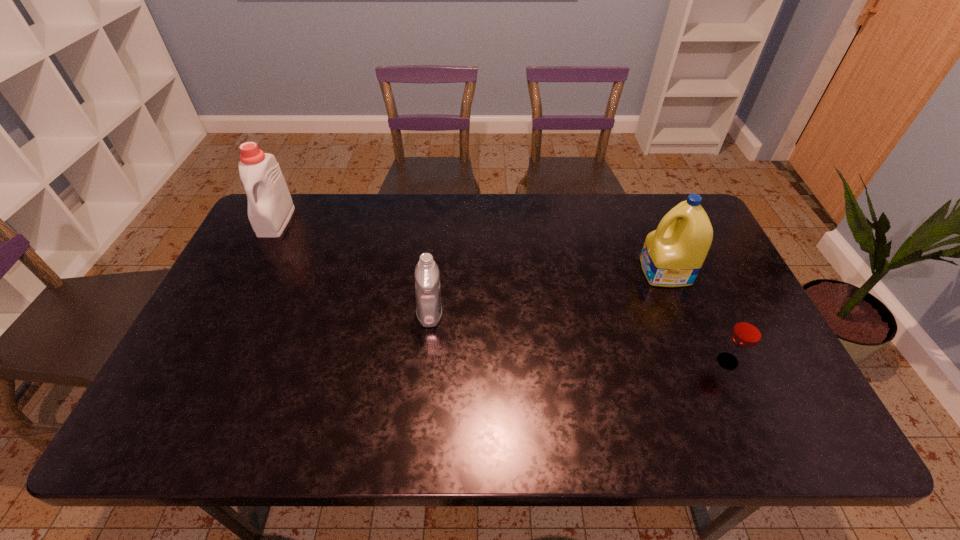
Where is `vacant region located on the label of the second nearest detergent`? The width and height of the screenshot is (960, 540). vacant region located on the label of the second nearest detergent is located at coordinates (533, 272).

Image resolution: width=960 pixels, height=540 pixels. In order to click on vacant area situated on the label of the second nearest detergent in this screenshot , I will do `click(594, 272)`.

You are a GUI agent. You are given a task and a screenshot of the screen. Output one action in this format:
    pyautogui.click(x=<x>, y=<y>)
    Task: Click on the vacant space located on the back of the nearest detergent
    
    Given the screenshot: What is the action you would take?
    pyautogui.click(x=439, y=224)

Identify the location of vacant space situated on the front of the glass. The height and width of the screenshot is (540, 960). (754, 418).

This screenshot has width=960, height=540. Identify the location of object that is at the far edge. (270, 207).

This screenshot has width=960, height=540. What are the coordinates of `object at the left edge` in the screenshot? It's located at (270, 207).

You are a GUI agent. You are given a task and a screenshot of the screen. Output one action in this format:
    pyautogui.click(x=<x>, y=<y>)
    Task: Click on the detergent situated at the right edge
    
    Given the screenshot: What is the action you would take?
    pyautogui.click(x=672, y=256)

Find the location of a particular element. The width and height of the screenshot is (960, 540). glass that is at the right edge is located at coordinates (747, 332).

Locate an element on the screen. The height and width of the screenshot is (540, 960). object at the far left corner is located at coordinates (270, 207).

Locate an element on the screen. vacant space at the far edge of the desktop is located at coordinates (489, 199).